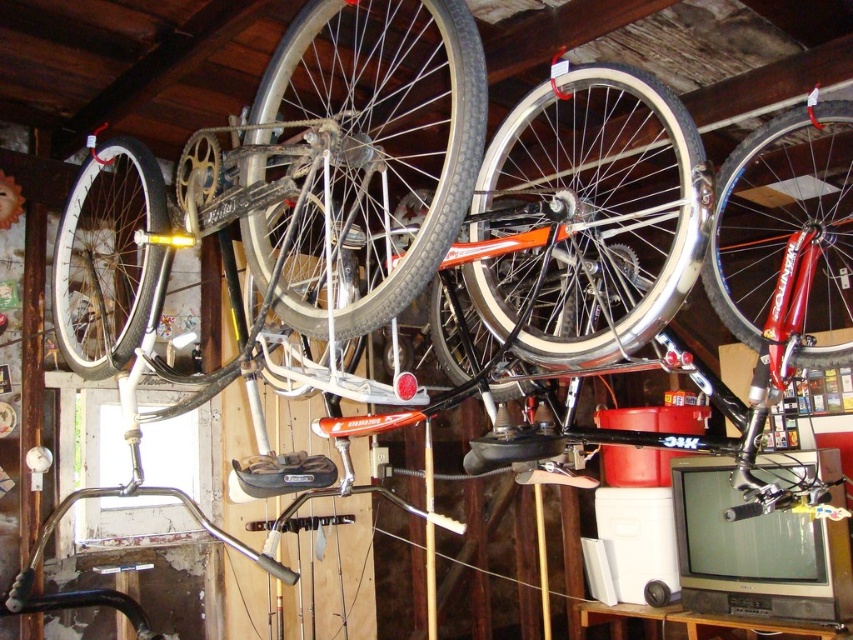
You are a mechanic trying to decide which bike part to work on first. The shiny red bicycle wheel at upper right and the shiny silver rim at left are both visible. Which one do you need to reach higher to access?

The shiny red bicycle wheel at upper right is bigger than the shiny silver rim at left, so you need to reach higher to access the shiny red bicycle wheel at upper right.

You are a mechanic trying to access the white rubber tire at center. There is a shiny silver bicycle wheel at upper center hanging above it. Can you reach the tire without moving the wheel?

The shiny silver bicycle wheel at upper center is 19.35 inches away from the white rubber tire at center. Since the distance between them is over 19 inches, you can safely reach the tire without disturbing the wheel.

You are a mechanic working in this garage. You need to access the shiny silver rim at left for repair. However, there is a shiny silver bicycle wheel at upper center directly above it. Can you safely reach the rim without disturbing the wheel?

The shiny silver bicycle wheel at upper center is positioned over the shiny silver rim at left, so you cannot safely reach the rim without moving the wheel first.